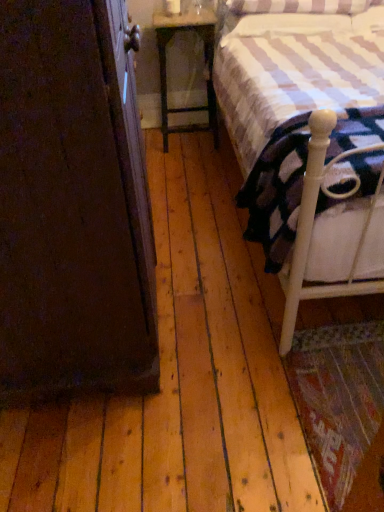
Image resolution: width=384 pixels, height=512 pixels. What are the coordinates of `vacant area that is in front of wooden nightstand at center` in the screenshot? It's located at (194, 158).